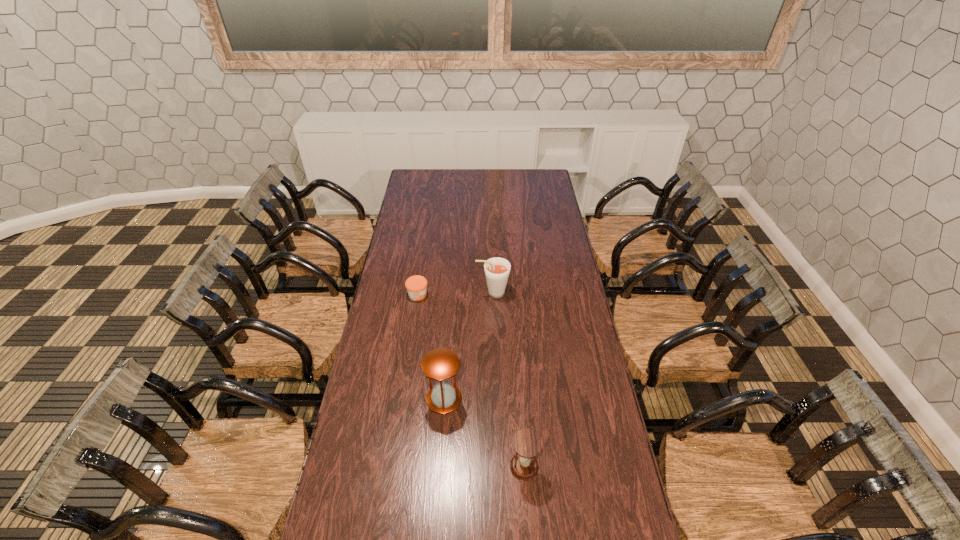
Locate an element on the screen. free space located on the left of the second object from left to right is located at coordinates (372, 399).

I want to click on vacant area situated on the left of the nearer hourglass, so click(x=416, y=467).

You are a GUI agent. You are given a task and a screenshot of the screen. Output one action in this format:
    pyautogui.click(x=<x>, y=<y>)
    Task: Click on the free space located 0.220m on the front label of the jam
    
    Given the screenshot: What is the action you would take?
    pyautogui.click(x=478, y=295)

Locate an element on the screen. This screenshot has height=540, width=960. object located at the left edge is located at coordinates (416, 285).

Image resolution: width=960 pixels, height=540 pixels. In order to click on blank space at the far edge of the desktop in this screenshot , I will do (508, 178).

In the image, there is a desktop. At what (x,y) coordinates should I click in order to perform the action: click on vacant space at the left edge. Please return your answer as a coordinate pair (x, y). The height and width of the screenshot is (540, 960). Looking at the image, I should click on (x=398, y=270).

At what (x,y) coordinates should I click in order to perform the action: click on free region at the right edge of the desktop. Please return your answer as a coordinate pair (x, y). Looking at the image, I should click on (557, 227).

Where is `blank space at the far left corner of the desktop`? This screenshot has width=960, height=540. blank space at the far left corner of the desktop is located at coordinates (420, 177).

The image size is (960, 540). In order to click on vacant space in between the root beer and the jam in this screenshot , I will do `click(455, 294)`.

At what (x,y) coordinates should I click in order to perform the action: click on empty location between the root beer and the second shortest object. Please return your answer as a coordinate pair (x, y). This screenshot has height=540, width=960. Looking at the image, I should click on (509, 380).